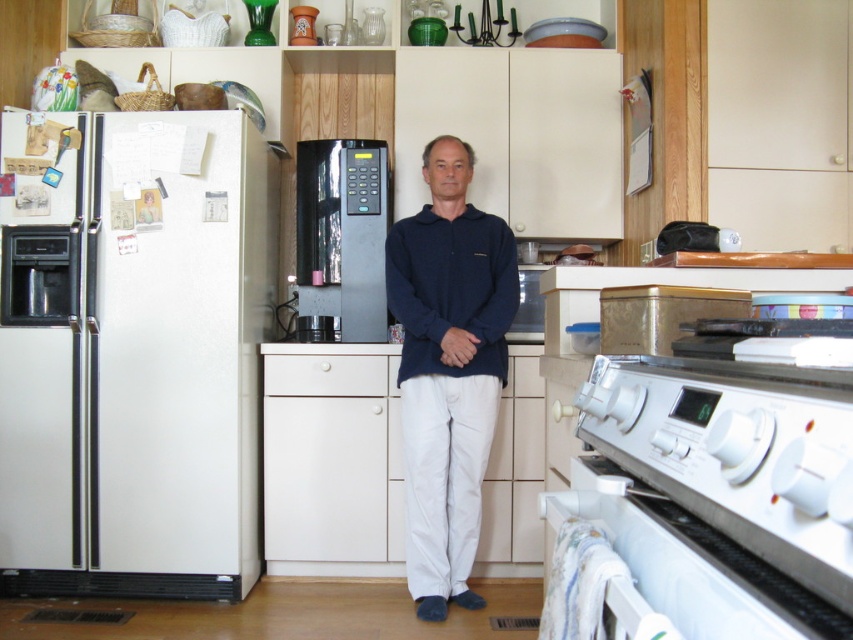
You are standing in the kitchen and want to reach both the refrigerator on the left and the stove on the right. Which of the two points, point 1 at coordinates point (762, 509) or point 2 at coordinates point (384, 212), is closer to you?

Point 1 at coordinates point (762, 509) is closer to you because it is in front of point 2 at coordinates point (384, 212).

You are planning to move the white glossy oven at lower right to the space currently occupied by the white matte refrigerator at left. Based on their sizes, will the oven fit into the refrigerator space?

The white matte refrigerator at left is wider than the white glossy oven at lower right. Therefore, the oven will fit into the refrigerator space since it is narrower.